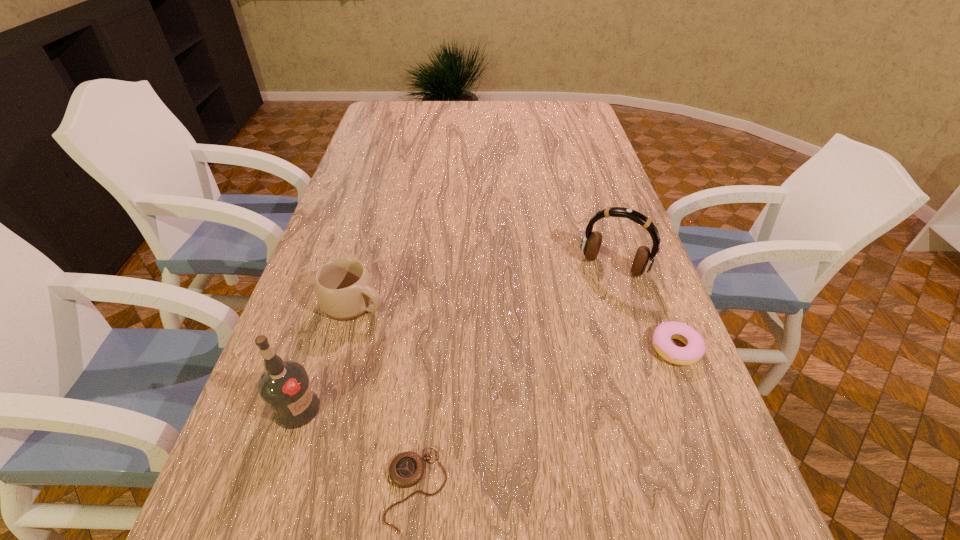
The height and width of the screenshot is (540, 960). I want to click on free space located 0.190m on the right of the third object from left to right, so click(555, 488).

This screenshot has height=540, width=960. Identify the location of free space located 0.170m on the left of the third farthest object. (575, 348).

Where is `free space located 0.250m on the side of the third tallest object with the handle`? free space located 0.250m on the side of the third tallest object with the handle is located at coordinates (473, 349).

Where is `vacant area located on the side of the third tallest object with the handle`? vacant area located on the side of the third tallest object with the handle is located at coordinates (406, 322).

Identify the location of vacant region located on the side of the third tallest object with the handle. The height and width of the screenshot is (540, 960). (431, 332).

Where is `vacant space located on the front label of the tallest object`? The height and width of the screenshot is (540, 960). vacant space located on the front label of the tallest object is located at coordinates [489, 415].

The height and width of the screenshot is (540, 960). I want to click on free space located on the front label of the tallest object, so pyautogui.click(x=378, y=411).

The height and width of the screenshot is (540, 960). In order to click on vacant space located 0.090m on the front label of the tallest object in this screenshot , I will do `click(364, 411)`.

Image resolution: width=960 pixels, height=540 pixels. Identify the location of blank space located 0.310m on the ear cup of the second tallest object. (557, 369).

Identify the location of vacant space located 0.230m on the ear cup of the second tallest object. This screenshot has width=960, height=540. (570, 343).